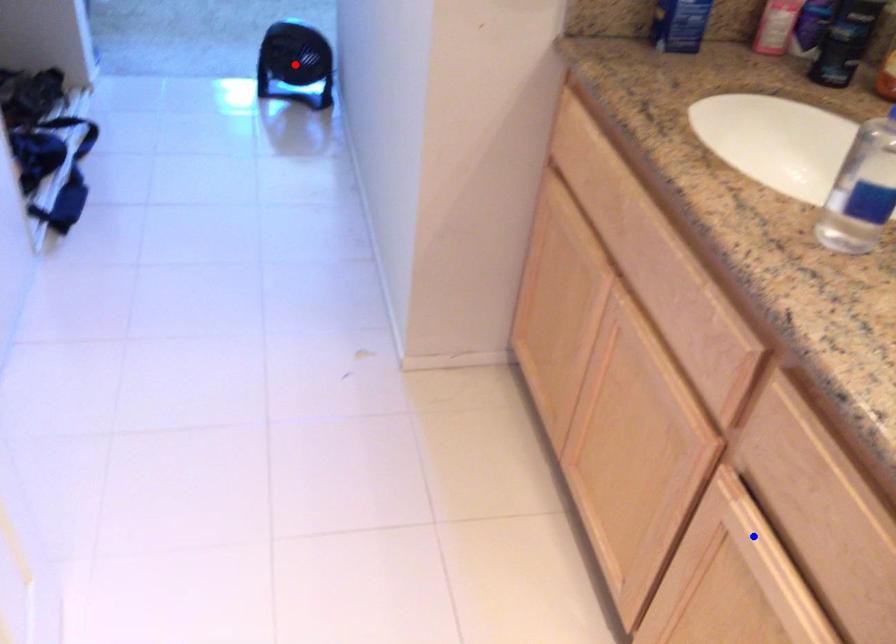
Question: Two points are marked on the image. Which point is closer to the camera?

Choices:
 (A) Blue point is closer.
 (B) Red point is closer.

Answer: (A)